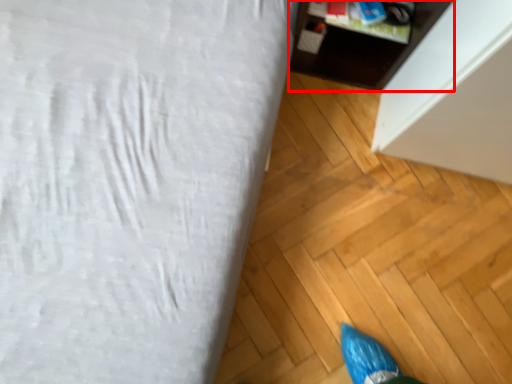
Question: From the image's perspective, what is the correct spatial relationship of furniture (annotated by the red box) in relation to furniture?

Choices:
 (A) below
 (B) above

Answer: (B)